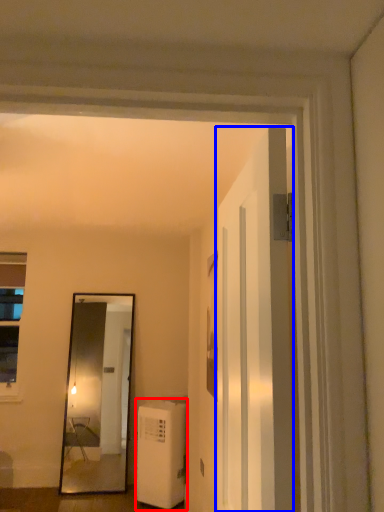
Question: Which object is further to the camera taking this photo, air conditioner (highlighted by a red box) or door (highlighted by a blue box)?

Choices:
 (A) air conditioner
 (B) door

Answer: (A)